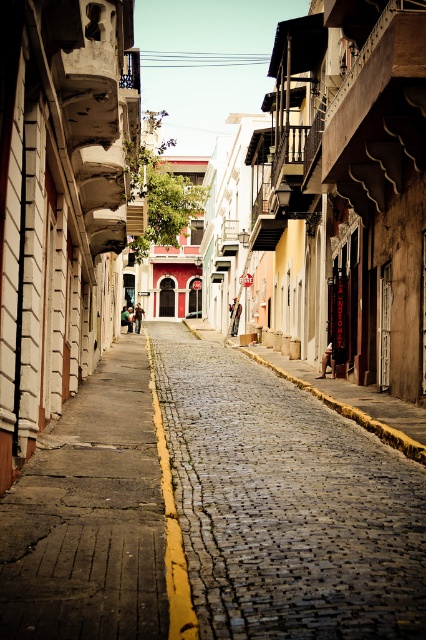
Is point (173, 426) in front of point (112, 353)?

Yes, point (173, 426) is closer to viewer.

Locate an element on the screen. cobblestone pavement at center is located at coordinates (285, 504).